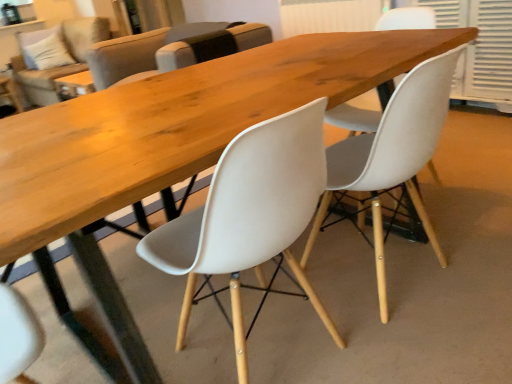
Question: Are beige fabric couch at upper left and matte white chair at center, which is the first chair from front to back, making contact?

Choices:
 (A) no
 (B) yes

Answer: (A)

Question: Can you confirm if beige fabric couch at upper left is taller than matte white chair at center, acting as the 3th chair starting from the back?

Choices:
 (A) no
 (B) yes

Answer: (B)

Question: From a real-world perspective, is beige fabric couch at upper left positioned over matte white chair at center, acting as the 3th chair starting from the back, based on gravity?

Choices:
 (A) no
 (B) yes

Answer: (B)

Question: Can you confirm if beige fabric couch at upper left is smaller than matte white chair at center, acting as the 3th chair starting from the back?

Choices:
 (A) no
 (B) yes

Answer: (A)

Question: Is beige fabric couch at upper left to the right of matte white chair at center, acting as the 3th chair starting from the back, from the viewer's perspective?

Choices:
 (A) no
 (B) yes

Answer: (A)

Question: Can you confirm if beige fabric couch at upper left is positioned to the left of matte white chair at center, which is the first chair from front to back?

Choices:
 (A) yes
 (B) no

Answer: (A)

Question: Considering the relative sizes of white plastic chair at center, which is the 3th chair from front to back, and matte white chair at center, which is the first chair from front to back, in the image provided, is white plastic chair at center, which is the 3th chair from front to back, smaller than matte white chair at center, which is the first chair from front to back,?

Choices:
 (A) no
 (B) yes

Answer: (A)

Question: Does white plastic chair at center, acting as the first chair starting from the back, have a greater width compared to matte white chair at center, acting as the 3th chair starting from the back?

Choices:
 (A) no
 (B) yes

Answer: (B)

Question: From a real-world perspective, is white plastic chair at center, which is the 3th chair from front to back, positioned over matte white chair at center, acting as the 3th chair starting from the back, based on gravity?

Choices:
 (A) yes
 (B) no

Answer: (A)

Question: Is white plastic chair at center, which is the 3th chair from front to back, closer to the viewer compared to matte white chair at center, which is the first chair from front to back?

Choices:
 (A) no
 (B) yes

Answer: (A)

Question: Is white plastic chair at center, acting as the first chair starting from the back, bigger than matte white chair at center, which is the first chair from front to back?

Choices:
 (A) no
 (B) yes

Answer: (B)

Question: Does white plastic chair at center, acting as the first chair starting from the back, have a greater height compared to matte white chair at center, acting as the 3th chair starting from the back?

Choices:
 (A) yes
 (B) no

Answer: (B)

Question: Would you say white plastic chair at center, which is the 3th chair from front to back, is part of white plastic chair at center, the 2th chair viewed from the front,'s contents?

Choices:
 (A) yes
 (B) no

Answer: (B)